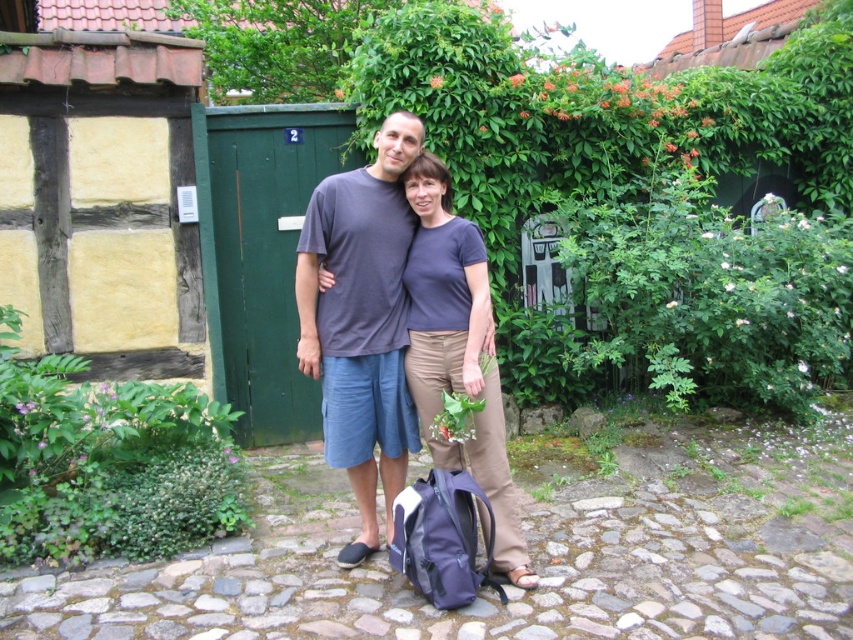
Does dark gray t-shirt at center appear on the left side of matte blue backpack at lower center?

Yes, dark gray t-shirt at center is to the left of matte blue backpack at lower center.

Based on the photo, can you confirm if dark gray t-shirt at center is smaller than matte blue backpack at lower center?

No.

In order to click on dark gray t-shirt at center in this screenshot , I will do `click(363, 321)`.

At what (x,y) coordinates should I click in order to perform the action: click on dark gray t-shirt at center. Please return your answer as a coordinate pair (x, y). The width and height of the screenshot is (853, 640). Looking at the image, I should click on (363, 321).